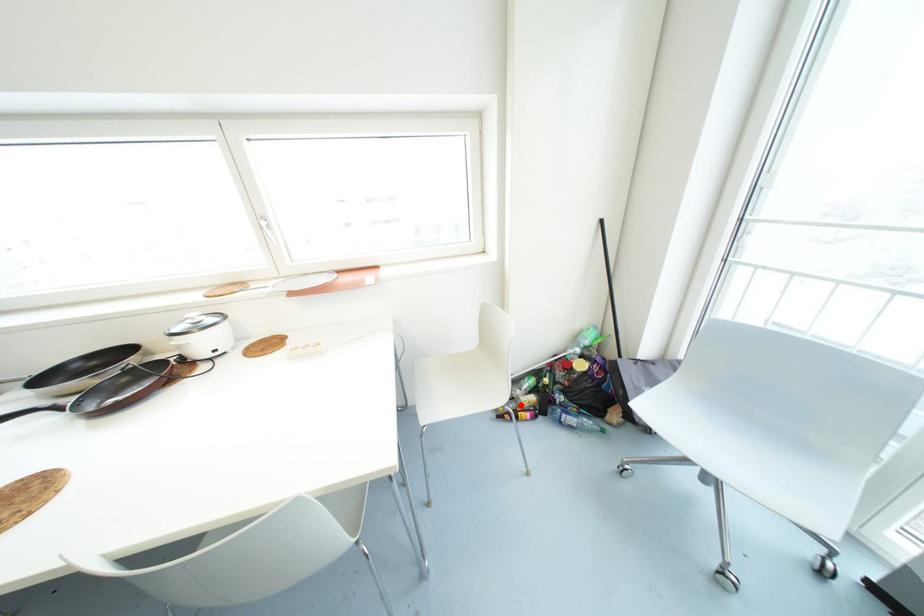
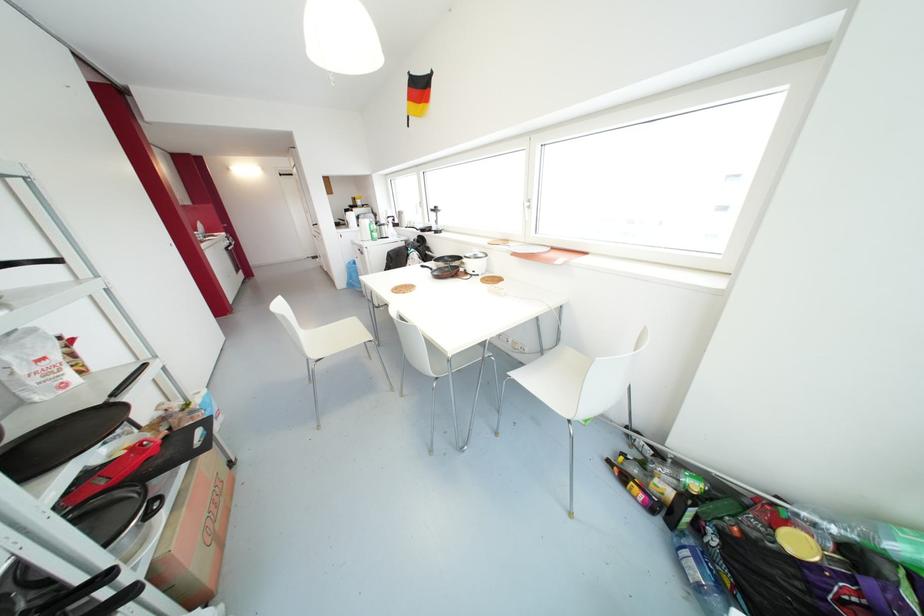
Question: A red point is marked in image1. In image2, is the corresponding 3D point closer to the camera or farther? Reply with the corresponding letter.

Choices:
 (A) The corresponding 3D point is closer.
 (B) The corresponding 3D point is farther.

Answer: (B)